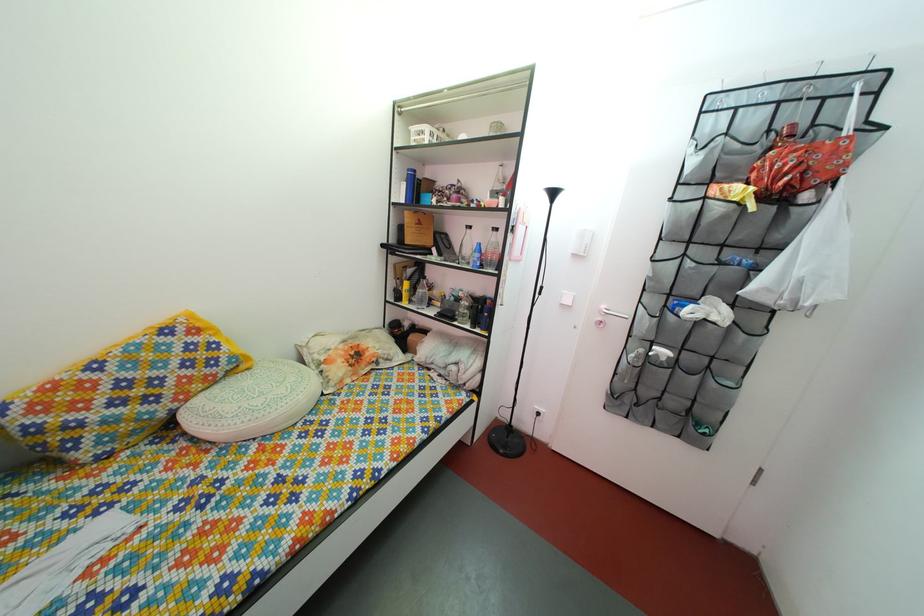
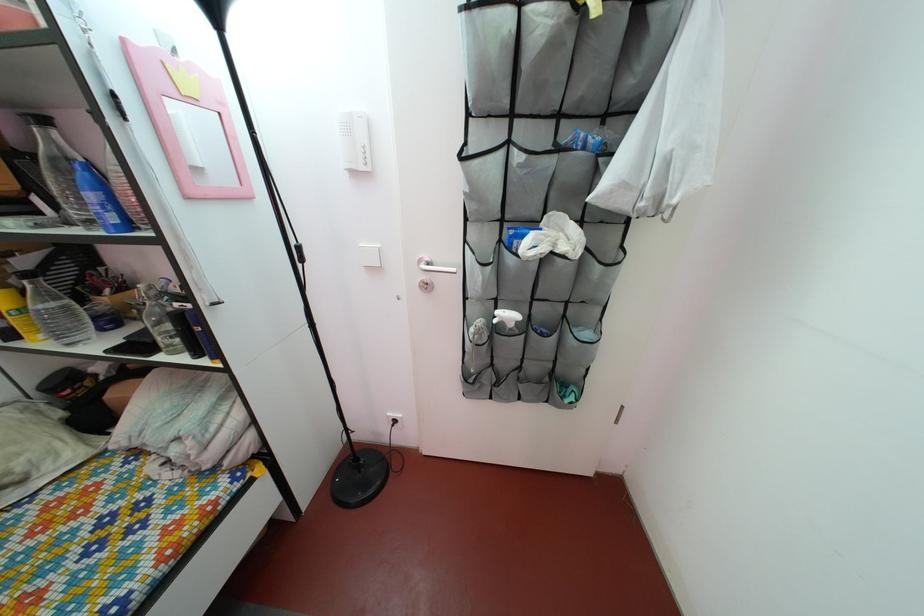
Question: I am providing you with two images of the same scene from different viewpoints. Which of the following objects are not visible in image2?

Choices:
 (A) white folded umbrella
 (B) dark water bottle
 (C) small black jar
 (D) none of these

Answer: (D)